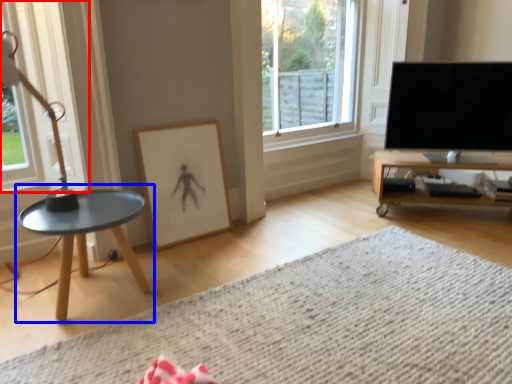
Question: Which object appears farthest to the camera in this image, window (highlighted by a red box) or coffee table (highlighted by a blue box)?

Choices:
 (A) window
 (B) coffee table

Answer: (B)